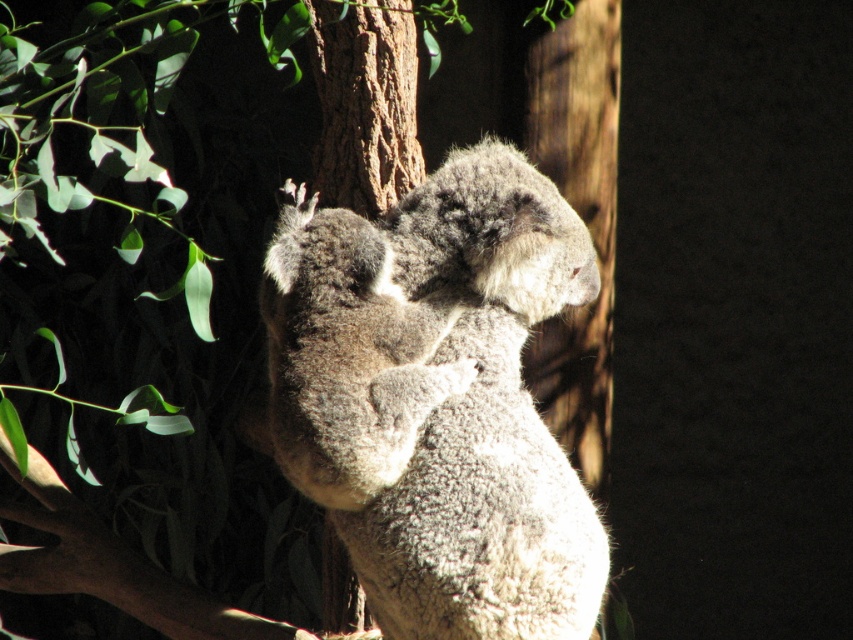
Question: Which point is closer to the camera?

Choices:
 (A) (500, 636)
 (B) (38, 584)

Answer: (A)

Question: Can you confirm if fuzzy gray koala at center is positioned to the right of brown textured tree trunk at center?

Choices:
 (A) no
 (B) yes

Answer: (A)

Question: Is fuzzy gray koala at center smaller than brown textured tree trunk at center?

Choices:
 (A) no
 (B) yes

Answer: (A)

Question: Is fuzzy gray koala at center thinner than brown textured tree trunk at center?

Choices:
 (A) yes
 (B) no

Answer: (B)

Question: Which of the following is the farthest from the observer?

Choices:
 (A) (434, 525)
 (B) (424, 438)

Answer: (B)

Question: Which point is closer to the camera?

Choices:
 (A) (138, 611)
 (B) (270, 292)

Answer: (B)